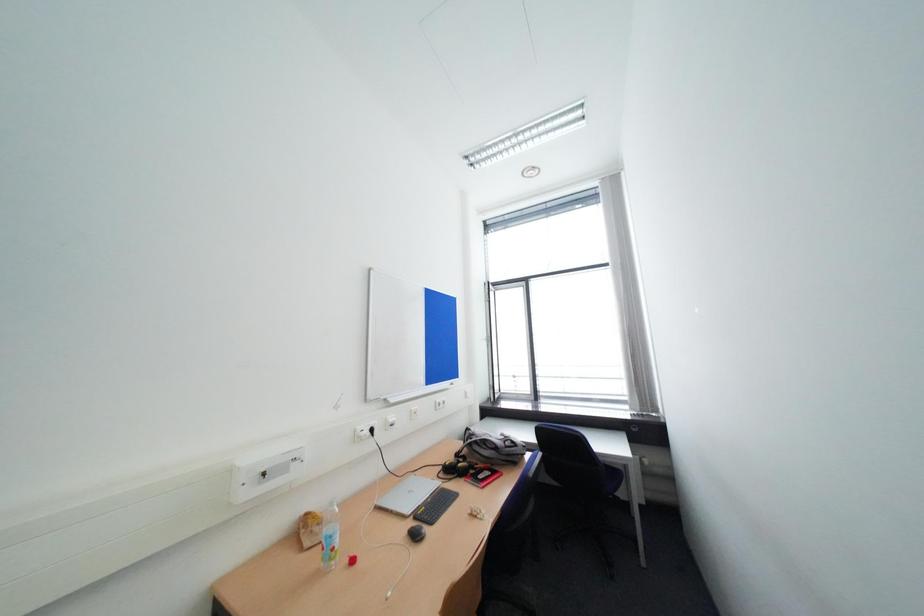
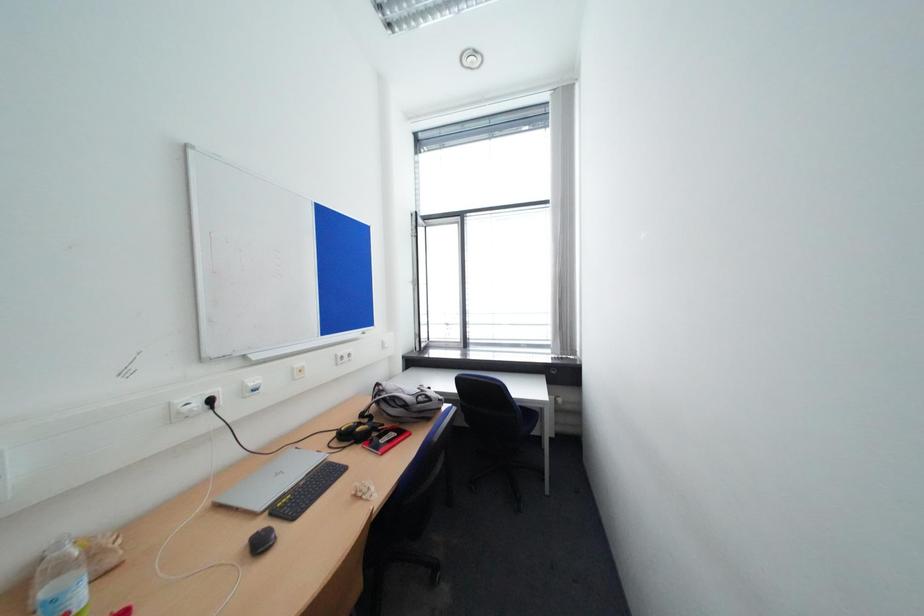
Question: The images are taken continuously from a first-person perspective. In which direction is your viewpoint rotating?

Choices:
 (A) Left
 (B) Right
 (C) Up
 (D) Down

Answer: (B)